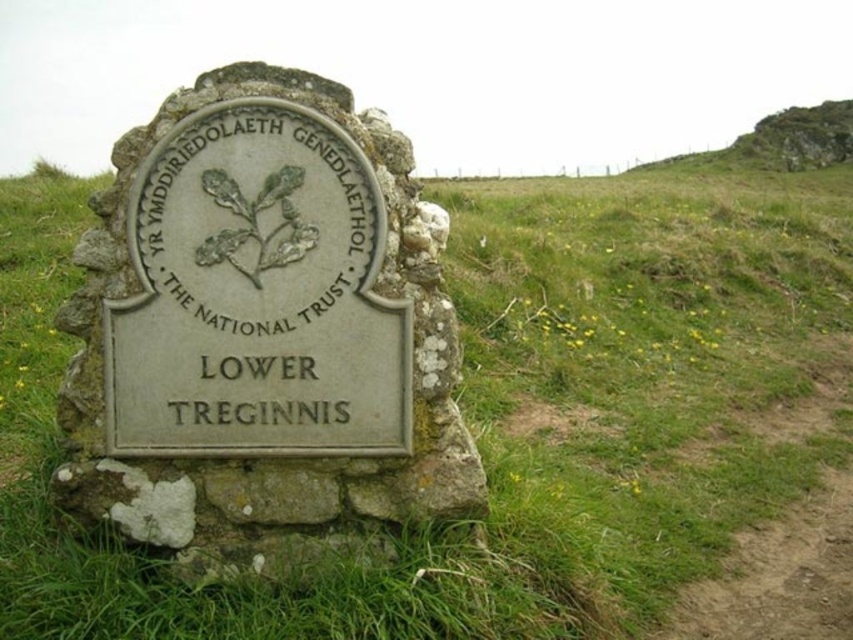
Question: Which point appears closest to the camera in this image?

Choices:
 (A) (381, 385)
 (B) (252, 394)

Answer: (A)

Question: Considering the relative positions of green grass at center and gray stone sign at center in the image provided, where is green grass at center located with respect to gray stone sign at center?

Choices:
 (A) below
 (B) above

Answer: (B)

Question: Is gray stone sign at center smaller than green stone plaque at center?

Choices:
 (A) no
 (B) yes

Answer: (A)

Question: Which point is closer to the camera?

Choices:
 (A) green grass at center
 (B) green grassy hillside at upper right

Answer: (A)

Question: Which point appears farthest from the camera in this image?

Choices:
 (A) (407, 416)
 (B) (335, 128)
 (C) (633, 458)

Answer: (C)

Question: Can you confirm if gray stone sign at center is smaller than green grassy hillside at upper right?

Choices:
 (A) no
 (B) yes

Answer: (B)